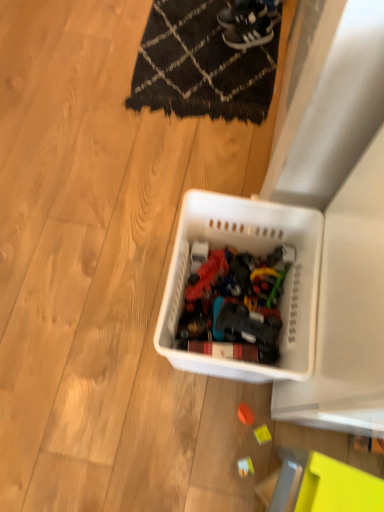
Locate an element on the screen. The width and height of the screenshot is (384, 512). vacant area that lies in front of white plastic toy at lower center, the third toy in the top-to-bottom sequence is located at coordinates (243, 495).